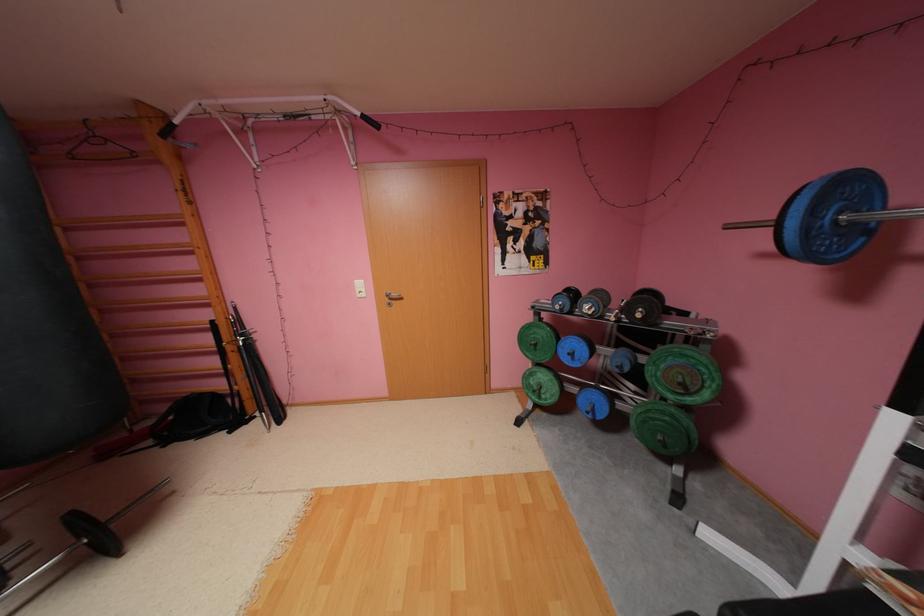
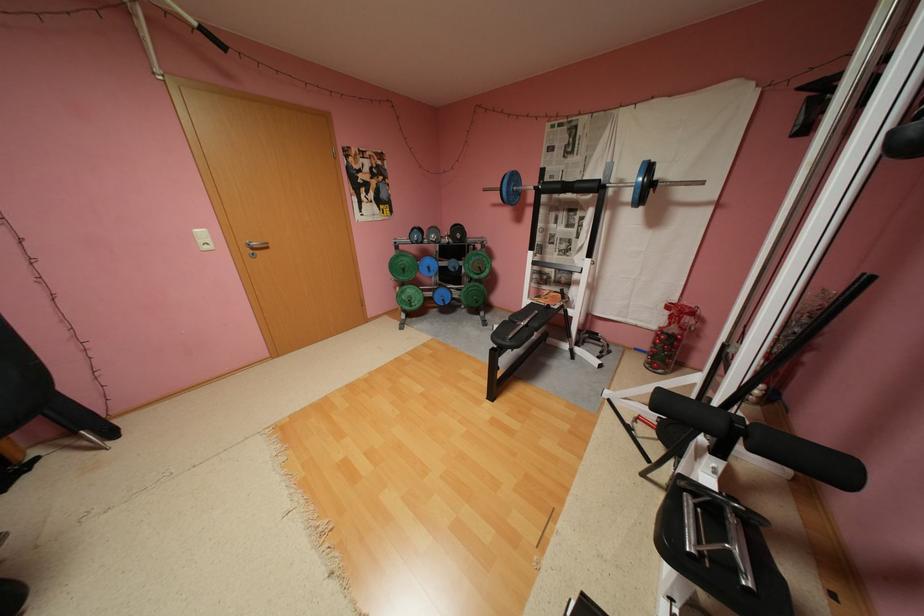
The point at (x=586, y=357) is marked in the first image. Where is the corresponding point in the second image?

(441, 269)